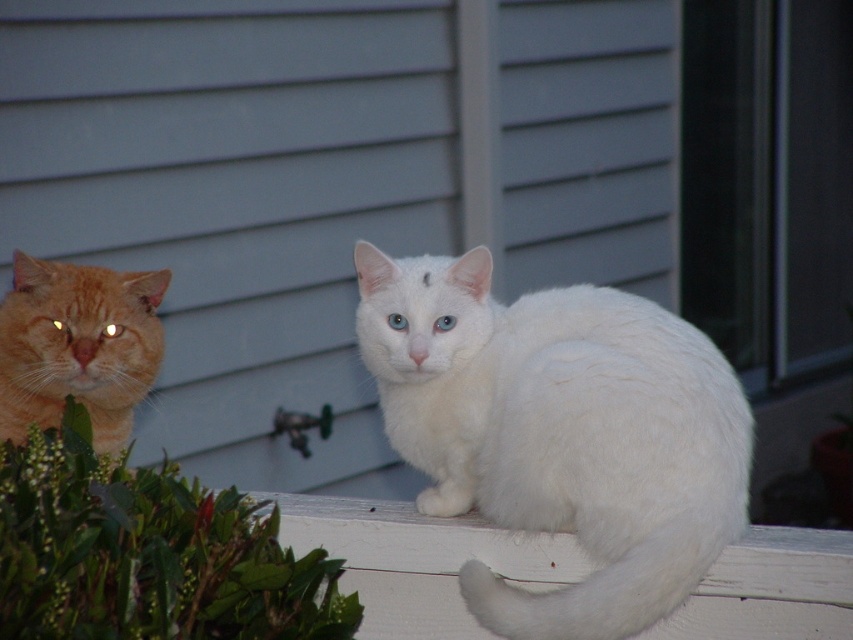
You are a small toy that is 10 cm tall. You are placed on the white painted wood at lower center. Can you stand upright without falling over the edge compared to the orange fur cat at left?

The white painted wood at lower center is shorter than orange fur cat at left, so the toy cannot stand upright without falling over the edge since the edge is lower than the cat.

Consider the image. You are a photographer trying to capture both the white fluffy cat at center and the orange fur cat at left in a single shot. Based on their positions and sizes, which cat might require more space in the frame to avoid being cropped out?

The white fluffy cat at center might be wider than the orange fur cat at left, so it might require more space in the frame to avoid being cropped out.